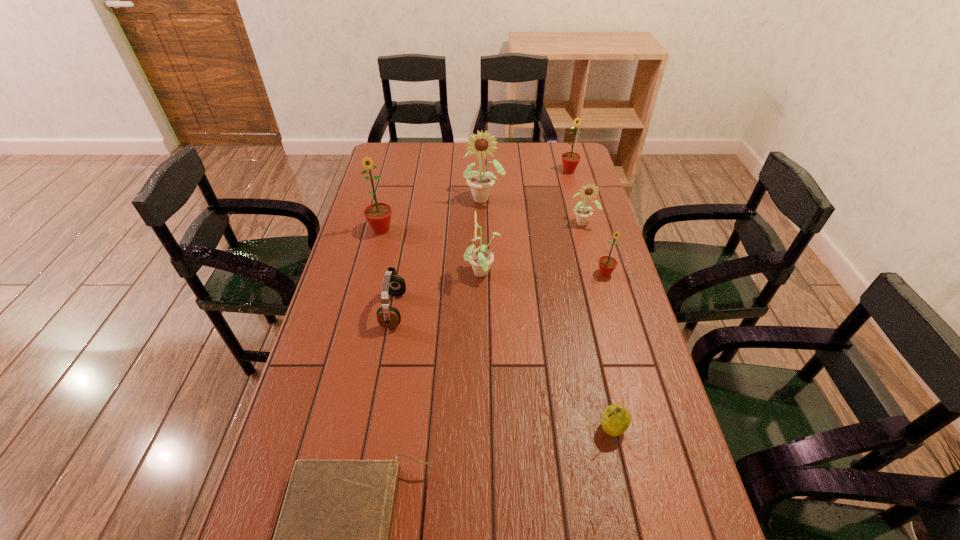
You are a GUI agent. You are given a task and a screenshot of the screen. Output one action in this format:
    pyautogui.click(x=<x>, y=<y>)
    Task: Click on the free space at the right edge of the desktop
    
    Given the screenshot: What is the action you would take?
    pyautogui.click(x=592, y=281)

At what (x,y) coordinates should I click in order to perform the action: click on vacant area at the far left corner of the desktop. Please return your answer as a coordinate pair (x, y). Looking at the image, I should click on (385, 151).

Identify the location of free space between the smallest green sunflower and the second farthest yellow sunflower. (594, 248).

Where is `free point between the farthest yellow sunflower and the nearest green sunflower`? This screenshot has width=960, height=540. free point between the farthest yellow sunflower and the nearest green sunflower is located at coordinates (544, 235).

Where is `free area in between the eighth tallest object and the smallest green sunflower`? This screenshot has width=960, height=540. free area in between the eighth tallest object and the smallest green sunflower is located at coordinates pos(609,351).

Locate an element on the screen. The width and height of the screenshot is (960, 540). free point between the biggest yellow sunflower and the biggest green sunflower is located at coordinates (432, 214).

Where is `free area in between the nearest green sunflower and the rightmost yellow sunflower`? Image resolution: width=960 pixels, height=540 pixels. free area in between the nearest green sunflower and the rightmost yellow sunflower is located at coordinates point(594,248).

The image size is (960, 540). I want to click on vacant space that is in between the third shortest object and the second biggest green sunflower, so click(x=590, y=300).

Identify the location of vacant point located between the ninth nearest object and the second farthest yellow sunflower. The image size is (960, 540). (533, 210).

Find the location of a particular element. This screenshot has width=960, height=540. object that is the fifth nearest to the second farthest object is located at coordinates pyautogui.click(x=607, y=264).